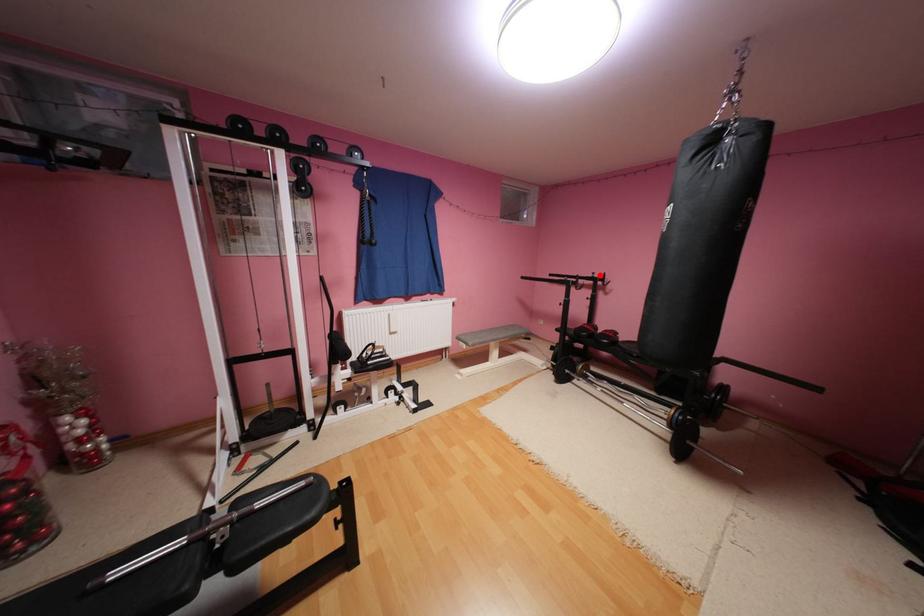
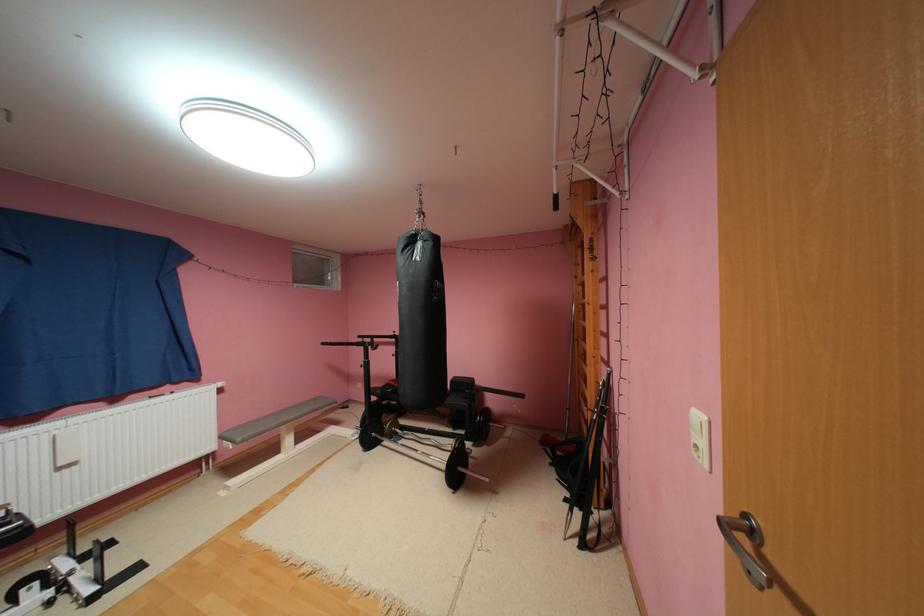
Locate, in the second image, the point that corresponds to the highlighted location in the first image.

(400, 334)